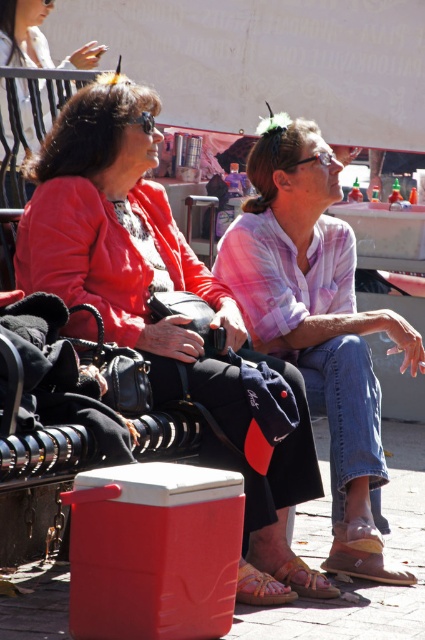
The height and width of the screenshot is (640, 425). What do you see at coordinates (260, 588) in the screenshot? I see `brown leather sandal at lower center` at bounding box center [260, 588].

Measure the distance between brown leather sandal at lower center and leather textured sandal at lower center.

8.24 inches

Is point (252, 584) in front of point (319, 586)?

That is True.

Locate an element on the screen. brown leather sandal at lower center is located at coordinates (260, 588).

Is matte black jacket at center to the left of leather textured sandal at lower center from the viewer's perspective?

Indeed, matte black jacket at center is positioned on the left side of leather textured sandal at lower center.

Which is behind, point (271, 536) or point (306, 564)?

The point (306, 564) is behind.

Where is `matte black jacket at center`? This screenshot has height=640, width=425. matte black jacket at center is located at coordinates (125, 244).

Between point (408, 348) and point (311, 595), which one is positioned in front?

Point (311, 595)

Is denim jeans at center below leather textured sandal at lower center?

Actually, denim jeans at center is above leather textured sandal at lower center.

Image resolution: width=425 pixels, height=640 pixels. What do you see at coordinates (317, 321) in the screenshot?
I see `denim jeans at center` at bounding box center [317, 321].

At what (x,y) coordinates should I click in order to perform the action: click on denim jeans at center. Please return your answer as a coordinate pair (x, y). Image resolution: width=425 pixels, height=640 pixels. Looking at the image, I should click on (317, 321).